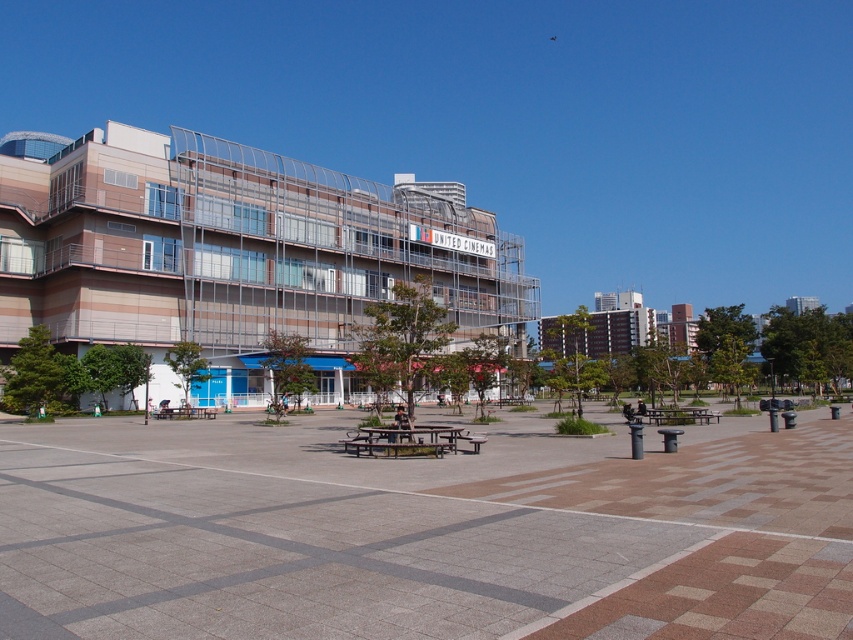
Question: Can you confirm if concrete paving at center is thinner than wooden picnic table at center?

Choices:
 (A) no
 (B) yes

Answer: (A)

Question: Does concrete paving at center appear on the left side of wooden picnic table at center?

Choices:
 (A) yes
 (B) no

Answer: (A)

Question: Which point is closer to the camera taking this photo?

Choices:
 (A) [399, 444]
 (B) [550, 509]

Answer: (B)

Question: Is concrete paving at center above wooden picnic table at center?

Choices:
 (A) no
 (B) yes

Answer: (B)